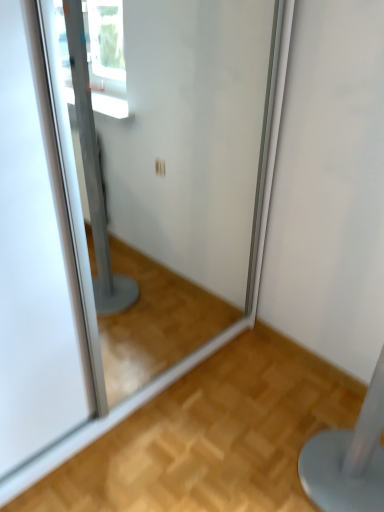
You are a GUI agent. You are given a task and a screenshot of the screen. Output one action in this format:
    pyautogui.click(x=<x>, y=<y>)
    Task: Click on the free space underneath clear glass mirror at center (from a real-world perspective)
    
    Given the screenshot: What is the action you would take?
    pyautogui.click(x=149, y=332)